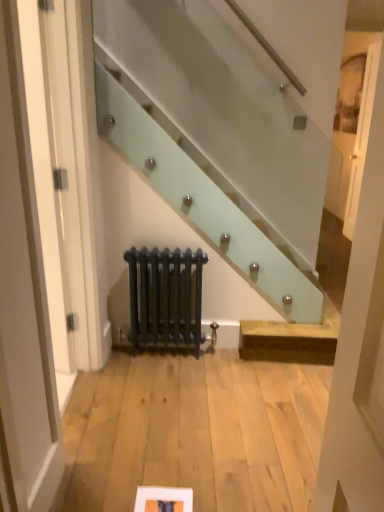
Where is `free space above matte white picture frame at lower center (from a real-world perspective)`? The width and height of the screenshot is (384, 512). free space above matte white picture frame at lower center (from a real-world perspective) is located at coordinates (162, 501).